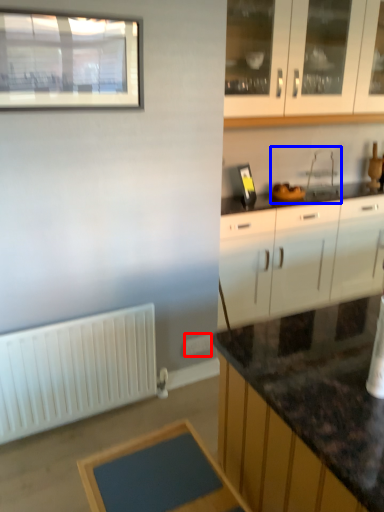
Question: Which object is closer to the camera taking this photo, electric outlet (highlighted by a red box) or sink (highlighted by a blue box)?

Choices:
 (A) electric outlet
 (B) sink

Answer: (A)